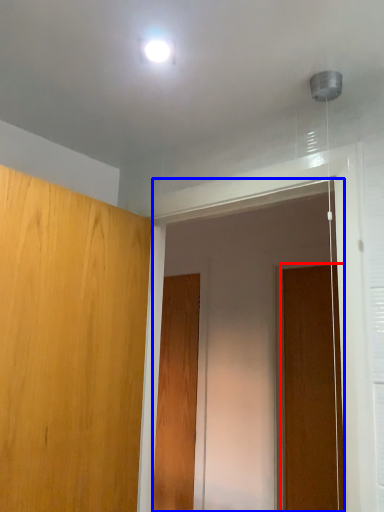
Question: Among these objects, which one is nearest to the camera, door (highlighted by a red box) or screen door (highlighted by a blue box)?

Choices:
 (A) door
 (B) screen door

Answer: (B)